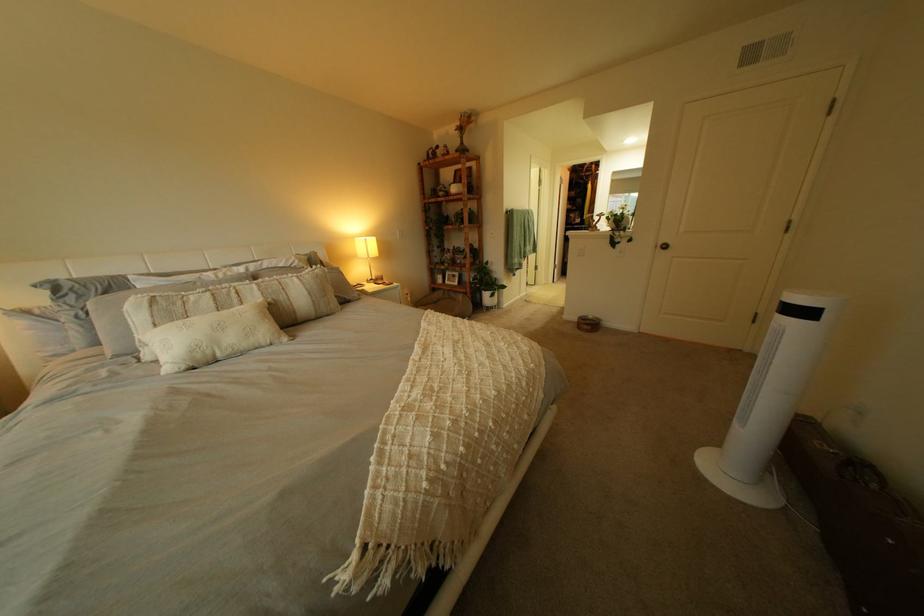
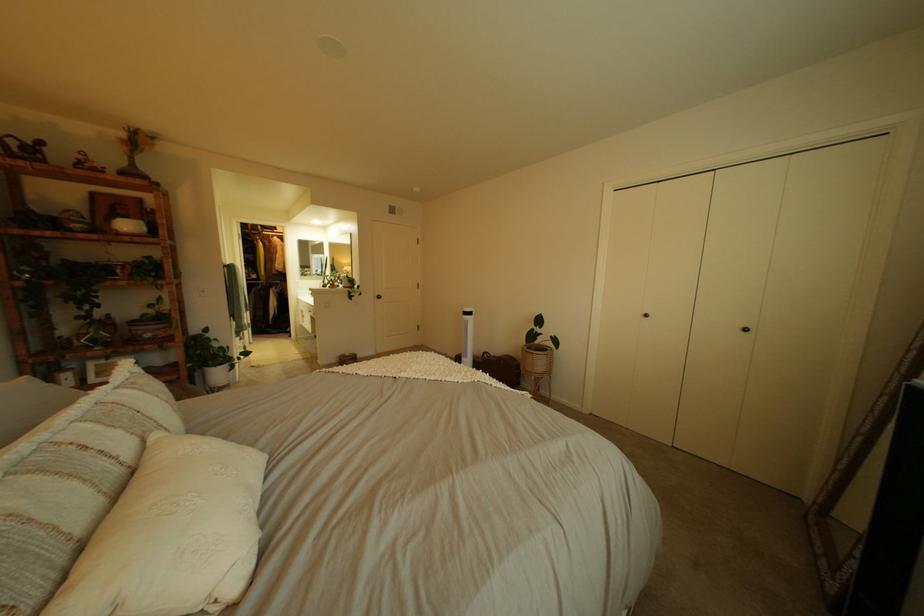
In the second image, find the point that corresponds to (x=274, y=294) in the first image.

(134, 434)